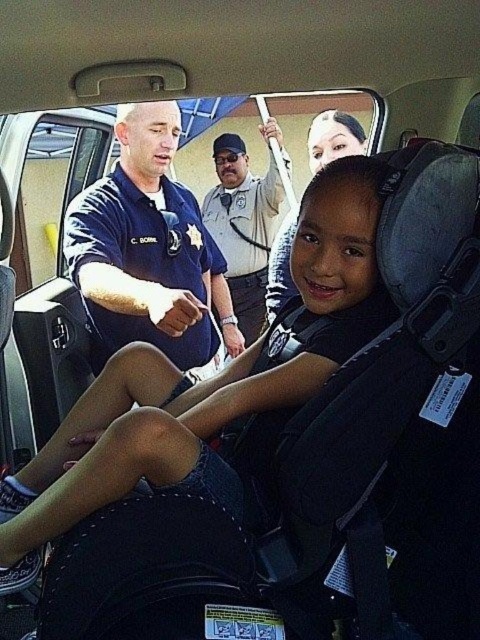
Between blue uniform shirt at upper left and light brown uniform at center, which one is positioned lower?

blue uniform shirt at upper left is lower down.

Is blue uniform shirt at upper left positioned in front of light brown uniform at center?

Yes, it is.

Is point (108, 227) behind point (218, 160)?

That is False.

This screenshot has width=480, height=640. Find the location of `blue uniform shirt at upper left`. blue uniform shirt at upper left is located at coordinates (143, 244).